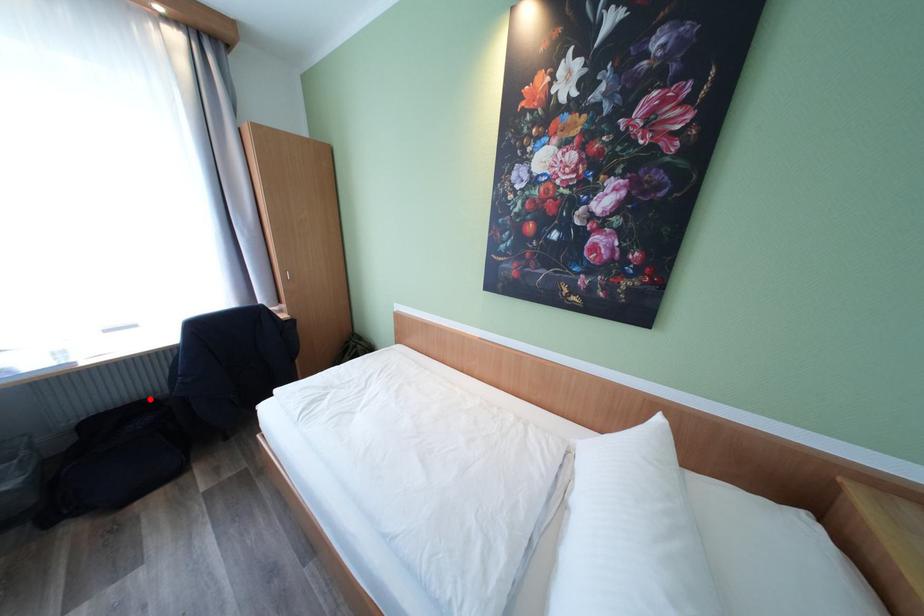
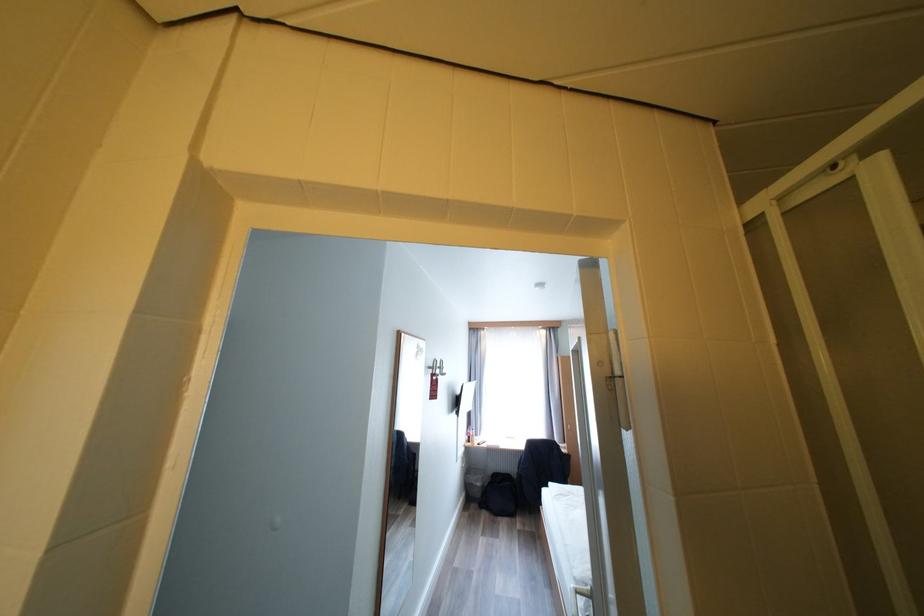
Question: I am providing you with two images of the same scene from different viewpoints. Given a red point in image1, look at the same physical point in image2. Is it:

Choices:
 (A) Closer to the viewpoint
 (B) Farther from the viewpoint

Answer: (B)